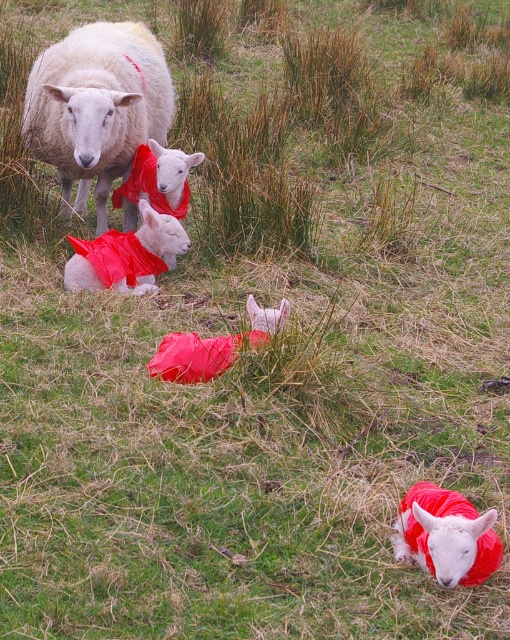
Question: Which object is the farthest from the matte red coat at lower right?

Choices:
 (A) matte red coat at center
 (B) white woolen sheep at upper left

Answer: (B)

Question: Which object is positioned closest to the matte red coat at center?

Choices:
 (A) matte red coat at lower right
 (B) white woolen sheep at upper left

Answer: (B)

Question: Does white woolen sheep at upper left appear on the left side of matte red coat at lower right?

Choices:
 (A) no
 (B) yes

Answer: (B)

Question: Which point appears farthest from the camera in this image?

Choices:
 (A) (145, 209)
 (B) (98, 106)
 (C) (487, 516)

Answer: (A)

Question: Observing the image, what is the correct spatial positioning of matte red coat at lower right in reference to matte red coat at center?

Choices:
 (A) right
 (B) left

Answer: (A)

Question: Is the position of white woolen sheep at upper left more distant than that of matte red coat at lower right?

Choices:
 (A) yes
 (B) no

Answer: (A)